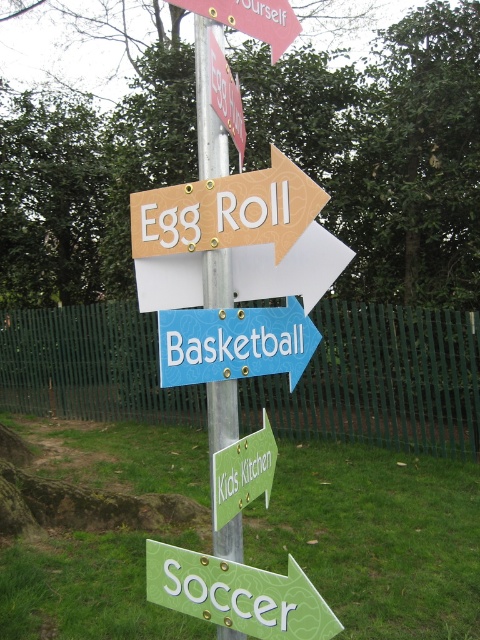
Does green matte arrow at lower center have a greater width compared to blue plastic basketball at center?

Indeed, green matte arrow at lower center has a greater width compared to blue plastic basketball at center.

Does green matte arrow at lower center appear on the right side of blue plastic basketball at center?

Indeed, green matte arrow at lower center is positioned on the right side of blue plastic basketball at center.

This screenshot has height=640, width=480. What do you see at coordinates (238, 595) in the screenshot?
I see `green matte arrow at lower center` at bounding box center [238, 595].

At what (x,y) coordinates should I click in order to perform the action: click on green matte arrow at lower center. Please return your answer as a coordinate pair (x, y). The height and width of the screenshot is (640, 480). Looking at the image, I should click on (238, 595).

Is green matte arrow at lower center positioned behind metallic pole at center?

No.

This screenshot has height=640, width=480. What are the coordinates of `green matte arrow at lower center` in the screenshot? It's located at (238, 595).

Where is `green matte arrow at lower center`? The height and width of the screenshot is (640, 480). green matte arrow at lower center is located at coordinates (238, 595).

Is matte wooden sign at upper center taller than blue plastic basketball at center?

Correct, matte wooden sign at upper center is much taller as blue plastic basketball at center.

Measure the distance between point (x=243, y=221) and camera.

A distance of 1.54 meters exists between point (x=243, y=221) and camera.

What do you see at coordinates (227, 211) in the screenshot? I see `matte wooden sign at upper center` at bounding box center [227, 211].

Find the location of a particular element. This screenshot has height=640, width=480. matte wooden sign at upper center is located at coordinates (227, 211).